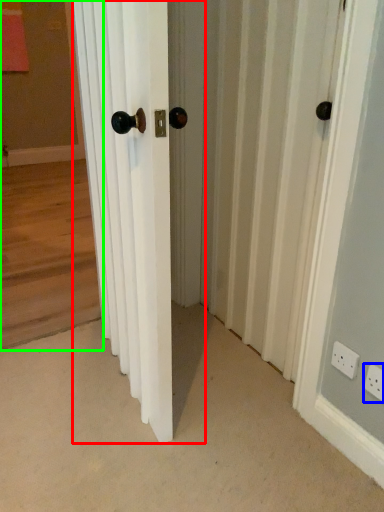
Question: Which object is positioned closest to door (highlighted by a red box)? Select from electric outlet (highlighted by a blue box) and corridor (highlighted by a green box).

Choices:
 (A) electric outlet
 (B) corridor

Answer: (A)